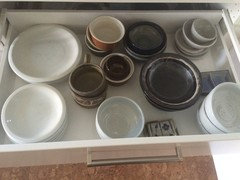
Locate an element on the screen. The height and width of the screenshot is (180, 240). inside drawer is located at coordinates (83, 130).